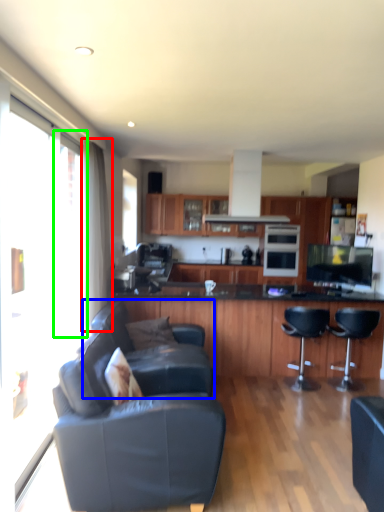
Question: Which object is positioned closest to curtain (highlighted by a red box)? Select from couch (highlighted by a blue box) and window (highlighted by a green box).

Choices:
 (A) couch
 (B) window

Answer: (B)